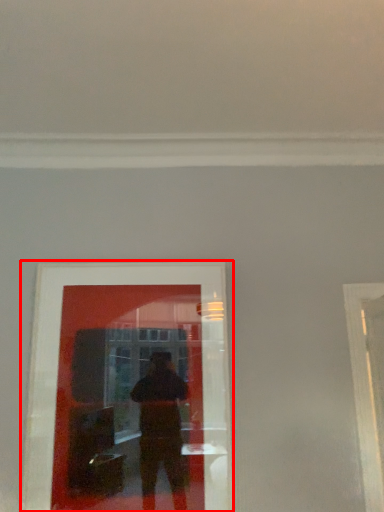
Question: Observing the image, what is the correct spatial positioning of picture frame (annotated by the red box) in reference to window frame?

Choices:
 (A) left
 (B) right

Answer: (A)